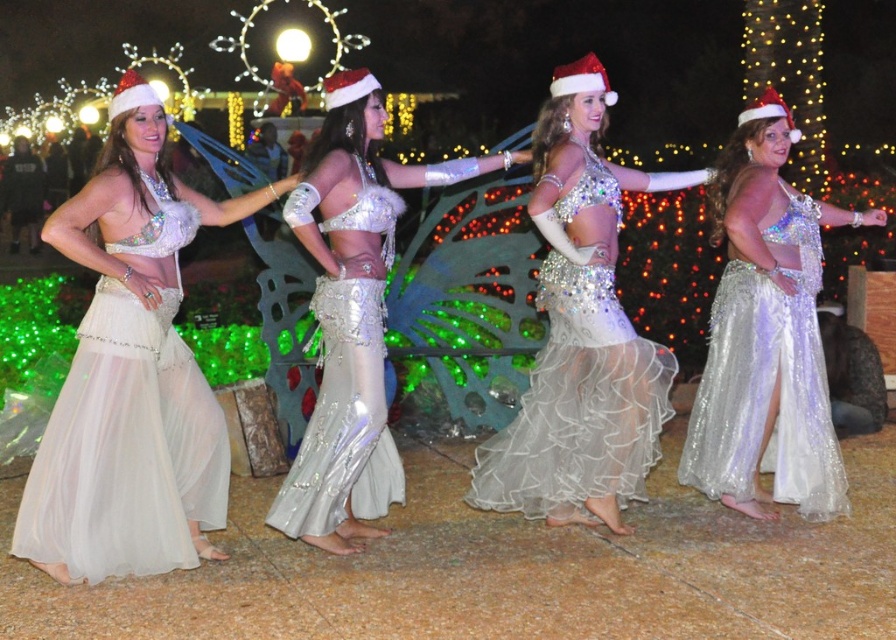
Question: Can you confirm if shiny silver skirt at right is thinner than shimmering sequined skirt at center?

Choices:
 (A) no
 (B) yes

Answer: (A)

Question: Which object is positioned closest to the shimmering sequined skirt at center?

Choices:
 (A) shiny silver skirt at center
 (B) matte silver belly dancer at left
 (C) shiny silver belly dancer at center

Answer: (C)

Question: Which point is closer to the camera?

Choices:
 (A) matte silver belly dancer at left
 (B) shiny silver skirt at center

Answer: (A)

Question: Is shiny silver skirt at right smaller than shiny silver belly dancer at center?

Choices:
 (A) yes
 (B) no

Answer: (A)

Question: Which object is positioned farthest from the shimmering sequined skirt at center?

Choices:
 (A) matte silver belly dancer at left
 (B) shiny silver skirt at center
 (C) shiny silver skirt at right

Answer: (A)

Question: Can you confirm if matte silver belly dancer at left is smaller than shiny silver belly dancer at center?

Choices:
 (A) yes
 (B) no

Answer: (A)